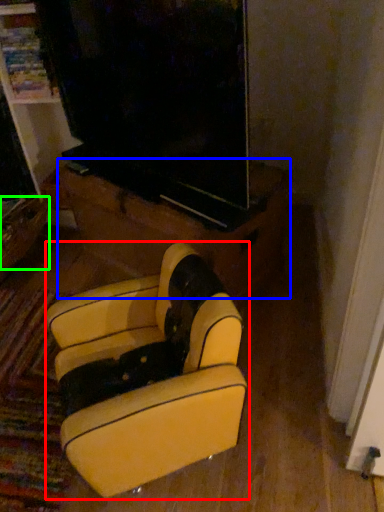
Question: Estimate the real-world distances between objects in this image. Which object is farther from furniture (highlighted by a red box), furniture (highlighted by a blue box) or drawer (highlighted by a green box)?

Choices:
 (A) furniture
 (B) drawer

Answer: (B)